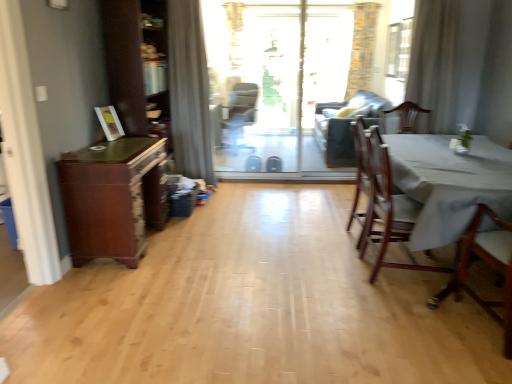
What do you see at coordinates (487, 264) in the screenshot? I see `light brown wooden chair at lower right, the third chair when ordered from back to front` at bounding box center [487, 264].

What is the approximate height of gray fabric curtain at upper center, acting as the 2th curtain starting from the right?

The height of gray fabric curtain at upper center, acting as the 2th curtain starting from the right, is 6.26 feet.

Describe the element at coordinates (449, 183) in the screenshot. I see `white cloth-covered table at right` at that location.

In order to face wooden chair at right, the 2th chair from the front, should I rotate leftwards or rightwards?

To align with it, rotate right about 19.791°.

The width and height of the screenshot is (512, 384). What do you see at coordinates (113, 198) in the screenshot?
I see `brown wood cabinet at left` at bounding box center [113, 198].

Measure the distance between mahogany wood chair at right, arranged as the 3th chair when viewed from the front, and camera.

A distance of 2.93 meters exists between mahogany wood chair at right, arranged as the 3th chair when viewed from the front, and camera.

The image size is (512, 384). In order to click on light brown wooden chair at lower right, the third chair when ordered from back to front in this screenshot , I will do `click(487, 264)`.

Measure the distance between transparent glass window screen at upper right and brown wood dresser at left.

The distance of transparent glass window screen at upper right from brown wood dresser at left is 3.49 meters.

Where is `dresser below the transparent glass window screen at upper right (from the image's perspective)`? The height and width of the screenshot is (384, 512). dresser below the transparent glass window screen at upper right (from the image's perspective) is located at coordinates pyautogui.click(x=136, y=62).

Which object is further away from the camera, transparent glass window screen at upper right or brown wood dresser at left?

transparent glass window screen at upper right is behind.

Is transparent glass window screen at upper right to the right of brown wood dresser at left from the viewer's perspective?

Correct, you'll find transparent glass window screen at upper right to the right of brown wood dresser at left.

I want to click on screen door that is above the light brown wooden chair at lower right, the third chair when ordered from back to front (from a real-world perspective), so click(x=282, y=75).

Does transparent glass screen door at center have a greater height compared to light brown wooden chair at lower right, the third chair when ordered from back to front?

Correct, transparent glass screen door at center is much taller as light brown wooden chair at lower right, the third chair when ordered from back to front.

Would you say light brown wooden chair at lower right, the third chair when ordered from back to front, is part of transparent glass screen door at center's contents?

No, light brown wooden chair at lower right, the third chair when ordered from back to front, is not a part of transparent glass screen door at center.

Looking at this image, considering the sizes of objects matte gray armchair at center and brown wood dresser at left in the image provided, who is taller, matte gray armchair at center or brown wood dresser at left?

With more height is brown wood dresser at left.

Does matte gray armchair at center come behind brown wood dresser at left?

Yes, matte gray armchair at center is further from the camera.

Image resolution: width=512 pixels, height=384 pixels. Identify the location of couch that is above the white cloth-covered table at right (from the image's perspective). (345, 126).

Looking at this image, from a real-world perspective, is white cloth-covered table at right positioned above or below dark gray fabric couch at center?

In terms of real-world spatial position, white cloth-covered table at right is below dark gray fabric couch at center.

Considering the relative sizes of white cloth-covered table at right and dark gray fabric couch at center in the image provided, is white cloth-covered table at right shorter than dark gray fabric couch at center?

Indeed, white cloth-covered table at right has a lesser height compared to dark gray fabric couch at center.

Is white cloth-covered table at right positioned with its back to dark gray fabric couch at center?

No, white cloth-covered table at right is not facing away from dark gray fabric couch at center.

Locate an element on the screen. table that is under the transparent glass screen door at center (from a real-world perspective) is located at coordinates pyautogui.click(x=449, y=183).

Can you confirm if white cloth-covered table at right is wider than transparent glass screen door at center?

Yes, white cloth-covered table at right is wider than transparent glass screen door at center.

Can you see white cloth-covered table at right touching transparent glass screen door at center?

No, white cloth-covered table at right is not touching transparent glass screen door at center.

Is the position of white cloth-covered table at right more distant than that of transparent glass screen door at center?

No, white cloth-covered table at right is closer to the viewer.

Considering the sizes of objects dark gray fabric couch at center and brown wood dresser at left in the image provided, who is wider, dark gray fabric couch at center or brown wood dresser at left?

dark gray fabric couch at center.

From a real-world perspective, which object rests below the other?

dark gray fabric couch at center, from a real-world perspective.

Considering the positions of point (367, 97) and point (122, 42), is point (367, 97) closer or farther from the camera than point (122, 42)?

Point (367, 97).

Considering the points (499, 241) and (378, 170), which point is in front, point (499, 241) or point (378, 170)?

The point (499, 241) is more forward.

Is light brown wooden chair at lower right, the first chair in the front-to-back sequence, bigger than wooden chair at right, the second chair when ordered from back to front?

Incorrect, light brown wooden chair at lower right, the first chair in the front-to-back sequence, is not larger than wooden chair at right, the second chair when ordered from back to front.

From a real-world perspective, which chair is the 2nd one above the light brown wooden chair at lower right, the first chair in the front-to-back sequence? Please provide its 2D coordinates.

[(389, 210)]

Are light brown wooden chair at lower right, the third chair when ordered from back to front, and wooden chair at right, the 2th chair from the front, beside each other?

There is a gap between light brown wooden chair at lower right, the third chair when ordered from back to front, and wooden chair at right, the 2th chair from the front.

Image resolution: width=512 pixels, height=384 pixels. I want to click on dresser that is in front of the transparent glass window screen at upper right, so click(136, 62).

Where is `screen door behind the light brown wooden chair at lower right, the third chair when ordered from back to front`? The height and width of the screenshot is (384, 512). screen door behind the light brown wooden chair at lower right, the third chair when ordered from back to front is located at coordinates (282, 75).

From the image, which object appears to be farther from white cloth-covered table at right, matte gray armchair at center or light brown wooden chair at lower right, the first chair in the front-to-back sequence?

matte gray armchair at center lies further to white cloth-covered table at right than the other object.

From the picture: Considering their positions, is white cloth-covered table at right positioned further to mahogany wood chair at right, arranged as the 3th chair when viewed from the front, than white sheer curtain at upper right, which is counted as the 2th curtain, starting from the left?

white sheer curtain at upper right, which is counted as the 2th curtain, starting from the left.

Based on their spatial positions, is brown wood cabinet at left or transparent glass window screen at upper right further from matte gray armchair at center?

brown wood cabinet at left is further to matte gray armchair at center.

From the image, which object appears to be nearer to matte gray armchair at center, wooden chair at right, the 2th chair from the front, or mahogany wood chair at right, the first chair in the back-to-front sequence?

mahogany wood chair at right, the first chair in the back-to-front sequence, is closer to matte gray armchair at center.

Looking at the image, which one is located further to brown wood cabinet at left, white sheer curtain at upper right, which ranks as the 1th curtain in right-to-left order, or transparent glass window screen at upper right?

The object further to brown wood cabinet at left is transparent glass window screen at upper right.

Considering their positions, is white sheer curtain at upper right, which is counted as the 2th curtain, starting from the left, positioned further to transparent glass window screen at upper right than white cloth-covered table at right?

The object further to transparent glass window screen at upper right is white cloth-covered table at right.

In the scene shown: Considering their positions, is gray fabric curtain at upper center, positioned as the first curtain in left-to-right order, positioned further to wooden chair at right, the 2th chair from the front, than dark gray fabric couch at center?

gray fabric curtain at upper center, positioned as the first curtain in left-to-right order, lies further to wooden chair at right, the 2th chair from the front, than the other object.

Based on their spatial positions, is light brown wooden chair at lower right, the first chair in the front-to-back sequence, or white sheer curtain at upper right, which is counted as the 2th curtain, starting from the left, further from white cloth-covered table at right?

Based on the image, white sheer curtain at upper right, which is counted as the 2th curtain, starting from the left, appears to be further to white cloth-covered table at right.

This screenshot has height=384, width=512. What are the coordinates of `window screen positioned between wooden chair at right, the 2th chair from the front, and matte gray armchair at center from near to far` in the screenshot? It's located at (398, 49).

In order to click on cabinetry between brown wood dresser at left and wooden chair at right, the 2th chair from the front in this screenshot , I will do `click(113, 198)`.

I want to click on curtain between brown wood cabinet at left and mahogany wood chair at right, arranged as the 3th chair when viewed from the front, so click(x=189, y=91).

Find the location of a particular element. chair positioned between wooden chair at right, the 2th chair from the front, and dark gray fabric couch at center from near to far is located at coordinates (361, 175).